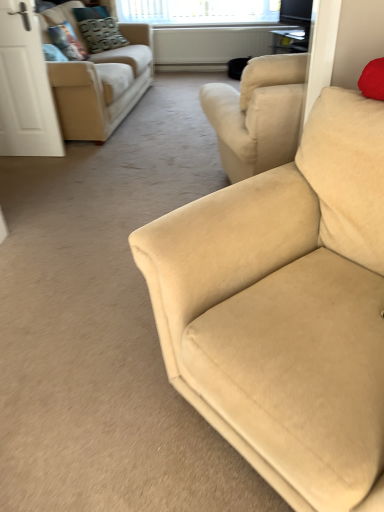
Question: Is velvet textured pillow at upper left, the first pillow positioned from the back, far away from clear glass window at upper center?

Choices:
 (A) no
 (B) yes

Answer: (A)

Question: Is velvet textured pillow at upper left, the 2th pillow from the front, located outside clear glass window at upper center?

Choices:
 (A) no
 (B) yes

Answer: (B)

Question: Is clear glass window at upper center surrounded by velvet textured pillow at upper left, the first pillow positioned from the back?

Choices:
 (A) yes
 (B) no

Answer: (B)

Question: Is velvet textured pillow at upper left, the 2th pillow from the front, positioned with its back to clear glass window at upper center?

Choices:
 (A) no
 (B) yes

Answer: (A)

Question: From the image's perspective, is velvet textured pillow at upper left, the 2th pillow from the front, located above clear glass window at upper center?

Choices:
 (A) yes
 (B) no

Answer: (B)

Question: Looking at their shapes, would you say beige fabric couch at right, the second studio couch viewed from the left, is wider or thinner than white matte door at left?

Choices:
 (A) wide
 (B) thin

Answer: (A)

Question: Considering the relative positions of beige fabric couch at right, the second studio couch viewed from the left, and white matte door at left in the image provided, is beige fabric couch at right, the second studio couch viewed from the left, to the left or to the right of white matte door at left?

Choices:
 (A) right
 (B) left

Answer: (A)

Question: Do you think beige fabric couch at right, placed as the second studio couch when sorted from top to bottom, is within white matte door at left, or outside of it?

Choices:
 (A) inside
 (B) outside

Answer: (B)

Question: From a real-world perspective, relative to white matte door at left, is beige fabric couch at right, which is the second studio couch in back-to-front order, vertically above or below?

Choices:
 (A) above
 (B) below

Answer: (B)

Question: From a real-world perspective, is white matte door at left positioned above or below clear glass window at upper center?

Choices:
 (A) below
 (B) above

Answer: (A)

Question: Is white matte door at left in front of or behind clear glass window at upper center in the image?

Choices:
 (A) behind
 (B) front

Answer: (B)

Question: In terms of height, does white matte door at left look taller or shorter compared to clear glass window at upper center?

Choices:
 (A) tall
 (B) short

Answer: (A)

Question: Would you say white matte door at left is inside or outside clear glass window at upper center?

Choices:
 (A) inside
 (B) outside

Answer: (B)

Question: Looking at their shapes, would you say white matte door at left is wider or thinner than beige fabric couch at upper left, the 1th studio couch from the back?

Choices:
 (A) thin
 (B) wide

Answer: (A)

Question: Is point tap(56, 135) closer or farther from the camera than point tap(91, 73)?

Choices:
 (A) closer
 (B) farther

Answer: (B)